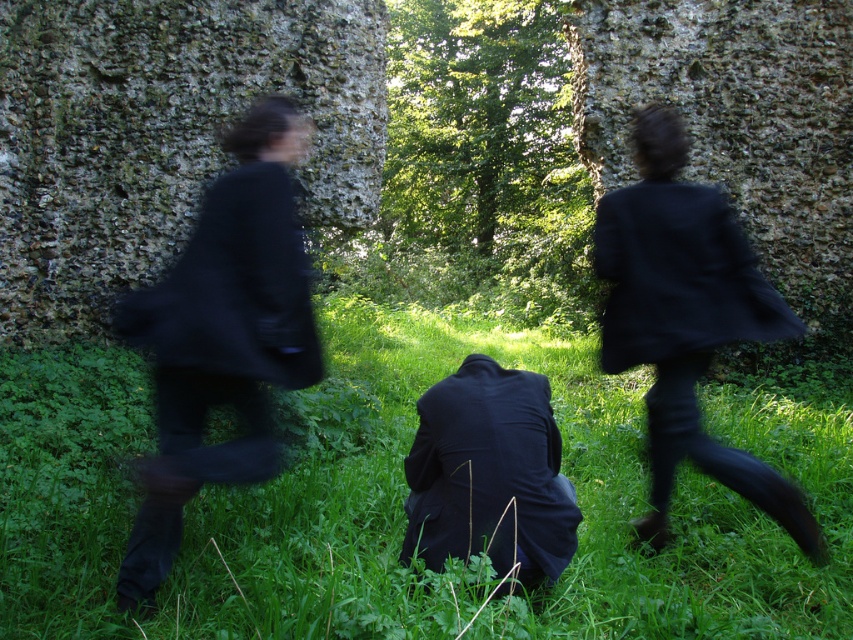
Question: Which point is closer to the camera?

Choices:
 (A) (569, 541)
 (B) (148, 332)
 (C) (656, 140)

Answer: (B)

Question: Does green grass at center appear on the right side of matte black suit at center?

Choices:
 (A) yes
 (B) no

Answer: (A)

Question: Can you confirm if green grass at center is positioned below matte black suit at left?

Choices:
 (A) no
 (B) yes

Answer: (B)

Question: Which point appears farthest from the camera in this image?

Choices:
 (A) [631, 285]
 (B) [107, 468]
 (C) [167, 385]

Answer: (B)

Question: Is matte black coat at right behind matte black suit at center?

Choices:
 (A) yes
 (B) no

Answer: (A)

Question: Which of the following is the closest to the observer?

Choices:
 (A) matte black suit at center
 (B) green grass at center

Answer: (A)